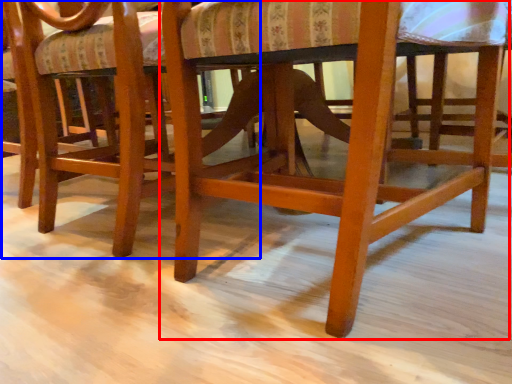
Question: Which point is closer to the camera, chair (highlighted by a red box) or chair (highlighted by a blue box)?

Choices:
 (A) chair
 (B) chair

Answer: (A)